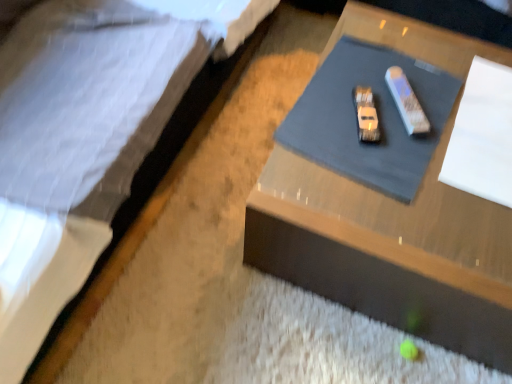
You are a GUI agent. You are given a task and a screenshot of the screen. Output one action in this format:
    pyautogui.click(x=<x>, y=<y>)
    Task: Click on the blank space situated above wooden table at center (from a real-world perspective)
    Image resolution: width=512 pixels, height=384 pixels.
    Given the screenshot: What is the action you would take?
    pyautogui.click(x=426, y=134)